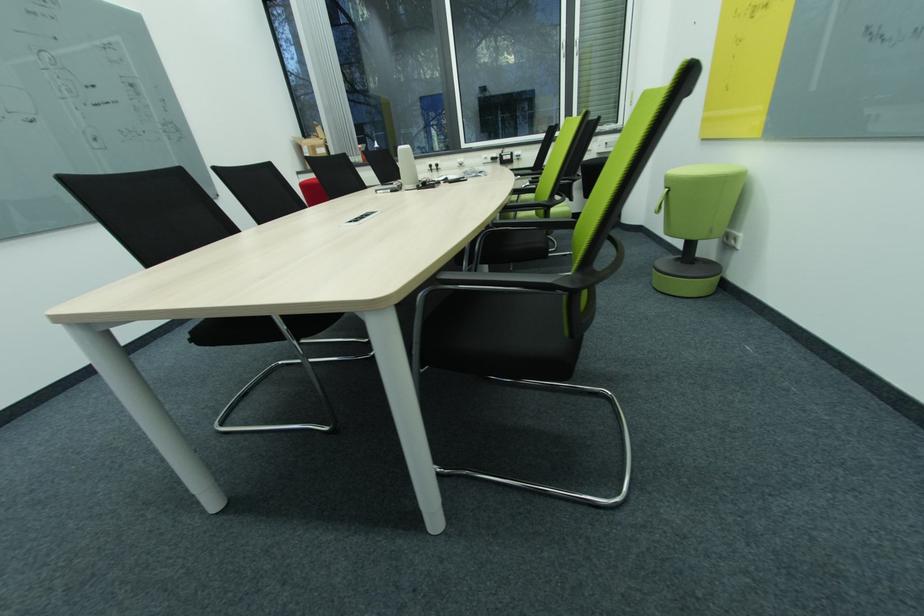
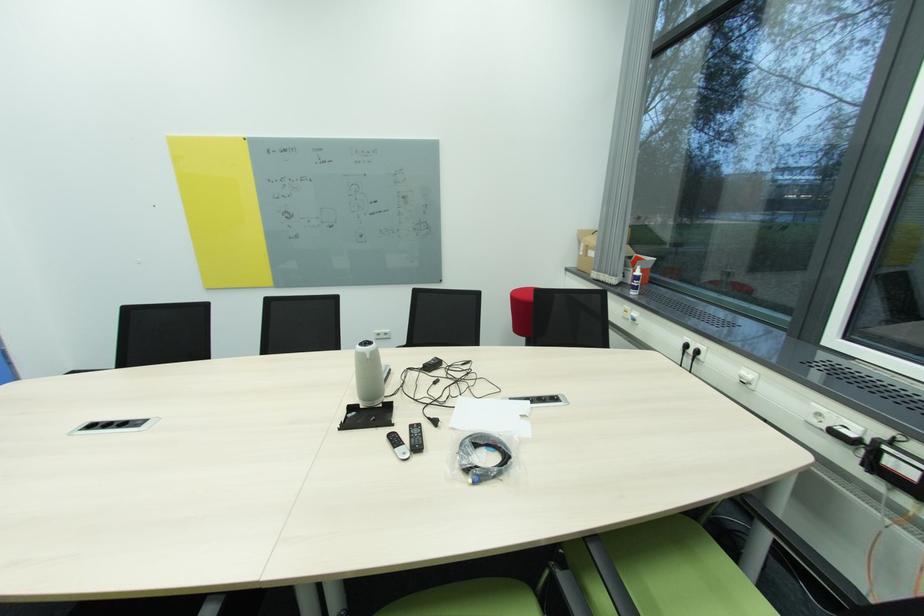
Where in the second image is the point corresponding to point 382,148 from the first image?

(639, 277)